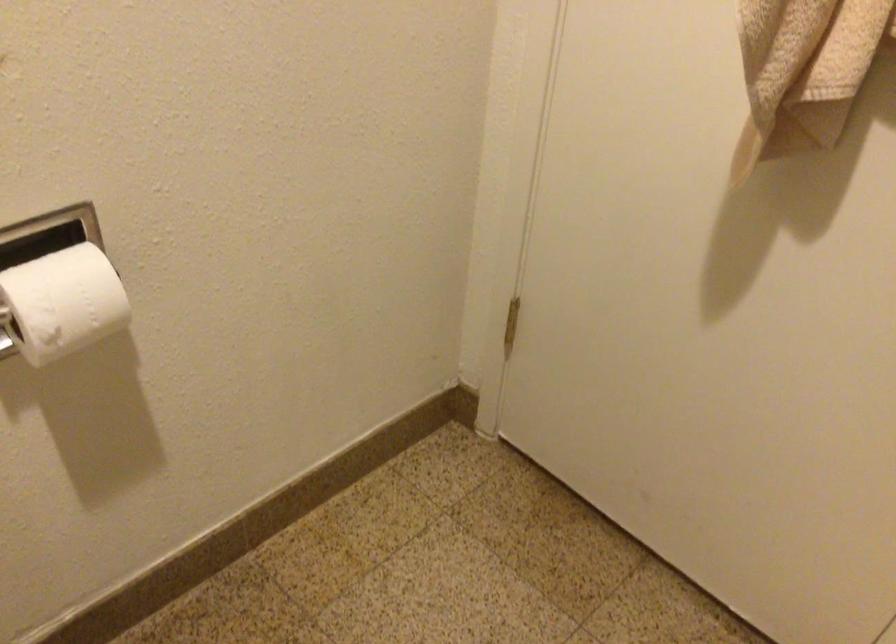
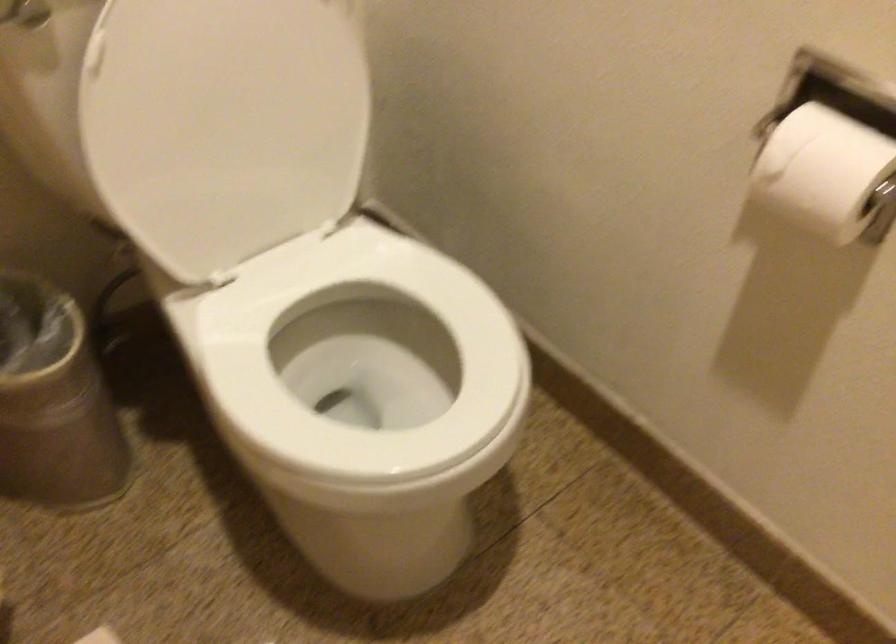
Find the pixel in the second image that matches point (97, 289) in the first image.

(824, 172)